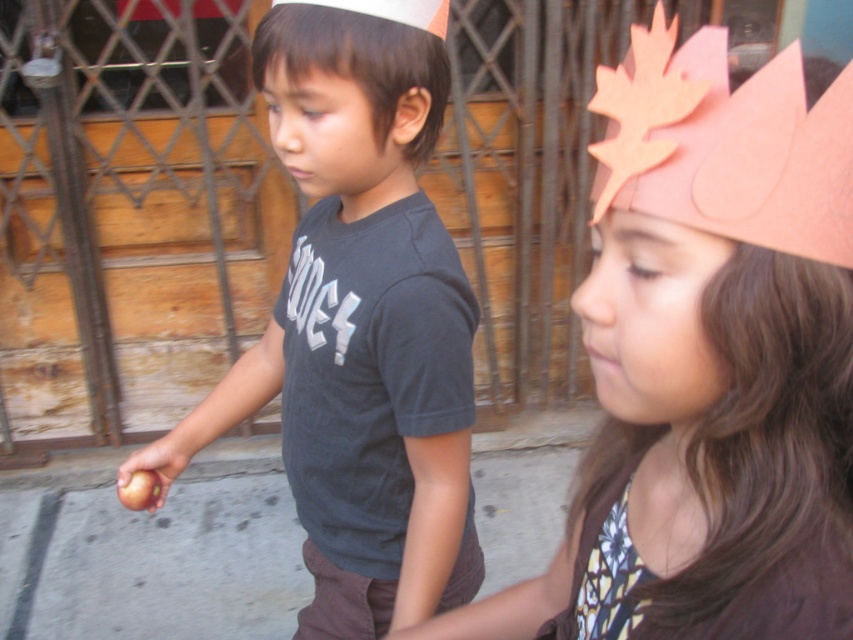
Is pink paper headdress at upper right smaller than matte black shirt at left?

Yes.

What do you see at coordinates (724, 145) in the screenshot? This screenshot has height=640, width=853. I see `pink paper headdress at upper right` at bounding box center [724, 145].

The image size is (853, 640). I want to click on pink paper headdress at upper right, so click(x=724, y=145).

Is pink paper crown at upper right behind matte black shirt at left?

That is False.

Between point (827, 500) and point (341, 20), which one is positioned behind?

The point (341, 20) is more distant.

Is point (682, 344) farther from viewer compared to point (257, 83)?

No, it is in front of (257, 83).

I want to click on pink paper crown at upper right, so click(706, 364).

In the scene shown: Does matte black shirt at center have a greater height compared to matte black shirt at left?

Yes, matte black shirt at center is taller than matte black shirt at left.

Based on the photo, is matte black shirt at center below matte black shirt at left?

Yes, matte black shirt at center is below matte black shirt at left.

Measure the distance between matte black shirt at center and camera.

matte black shirt at center is 32.16 inches from camera.

I want to click on matte black shirt at center, so click(358, 321).